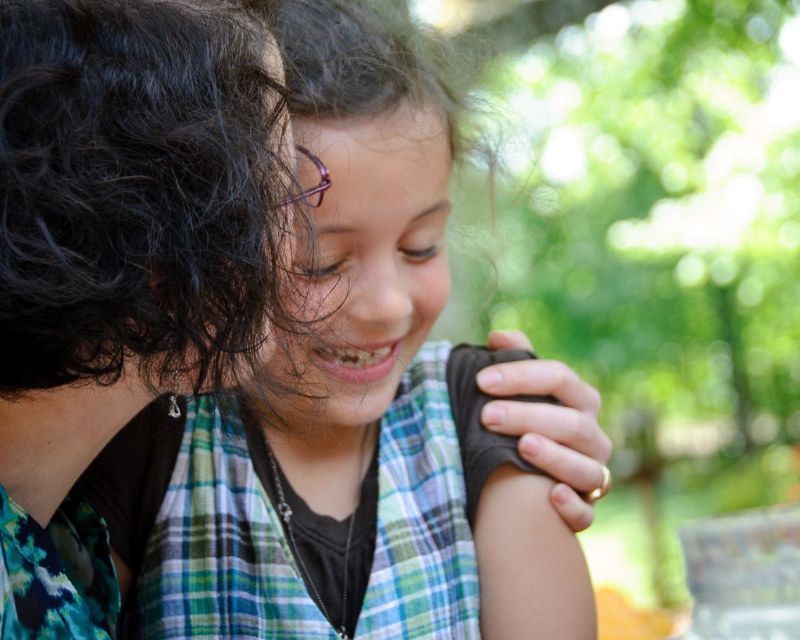
Question: Can you confirm if black fabric at upper left is wider than matte green plaid shirt at center?

Choices:
 (A) yes
 (B) no

Answer: (A)

Question: Can you confirm if green plaid shirt at center is positioned to the left of matte green plaid shirt at center?

Choices:
 (A) yes
 (B) no

Answer: (A)

Question: Which point is farther from the camera taking this photo?

Choices:
 (A) (5, 131)
 (B) (329, 522)

Answer: (B)

Question: Is black fabric at upper left above matte green plaid shirt at center?

Choices:
 (A) no
 (B) yes

Answer: (A)

Question: Based on their relative distances, which object is farther from the green plaid shirt at center?

Choices:
 (A) black fabric at upper left
 (B) matte green plaid shirt at center

Answer: (A)

Question: Estimate the real-world distances between objects in this image. Which object is closer to the black fabric at upper left?

Choices:
 (A) matte green plaid shirt at center
 (B) green plaid shirt at center

Answer: (A)